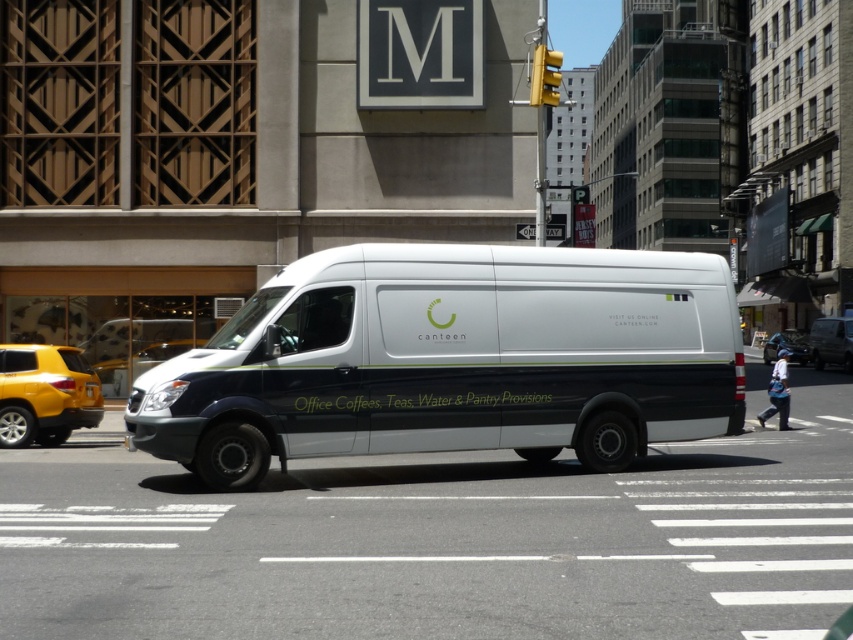
Is point (82, 416) farther from camera compared to point (848, 321)?

No, (82, 416) is closer to viewer.

Can you confirm if yellow matte suv at left is positioned to the right of metallic silver van at center?

In fact, yellow matte suv at left is to the left of metallic silver van at center.

Does point (4, 428) lie in front of point (844, 349)?

That is True.

At what (x,y) coordinates should I click in order to perform the action: click on yellow matte suv at left. Please return your answer as a coordinate pair (x, y). This screenshot has height=640, width=853. Looking at the image, I should click on (45, 394).

Measure the distance between metallic silver van at center and camera.

metallic silver van at center and camera are 45.75 meters apart from each other.

Is point (843, 342) in front of point (804, 333)?

Yes, point (843, 342) is closer to viewer.

You are a GUI agent. You are given a task and a screenshot of the screen. Output one action in this format:
    pyautogui.click(x=<x>, y=<y>)
    Task: Click on the metallic silver van at center
    
    Given the screenshot: What is the action you would take?
    pyautogui.click(x=831, y=342)

Between point (166, 419) and point (94, 392), which one is positioned in front?

Point (166, 419)

Find the location of a particular element. This screenshot has width=853, height=640. white matte van at center is located at coordinates (453, 358).